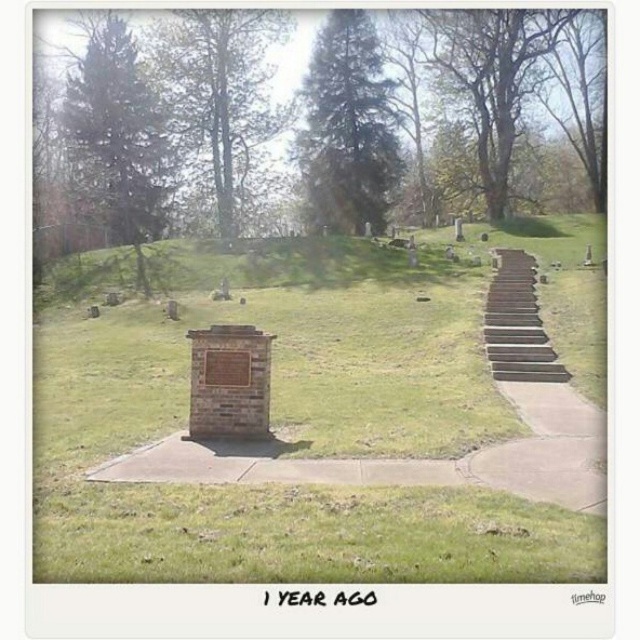
Question: Which point is closer to the camera?

Choices:
 (A) (561, 368)
 (B) (172, 397)
 (C) (497, 291)

Answer: (B)

Question: Can you confirm if brown wooden stairs at right is smaller than wooden stairs at right?

Choices:
 (A) no
 (B) yes

Answer: (A)

Question: Can you confirm if brown wooden stairs at right is positioned above wooden stairs at right?

Choices:
 (A) yes
 (B) no

Answer: (B)

Question: Which is nearer to the green grassy at center?

Choices:
 (A) brown wooden stairs at right
 (B) wooden stairs at right

Answer: (A)

Question: Is green grassy at center bigger than wooden stairs at right?

Choices:
 (A) yes
 (B) no

Answer: (A)

Question: Among these objects, which one is farthest from the camera?

Choices:
 (A) green grassy at center
 (B) brown wooden stairs at right
 (C) wooden stairs at right

Answer: (C)